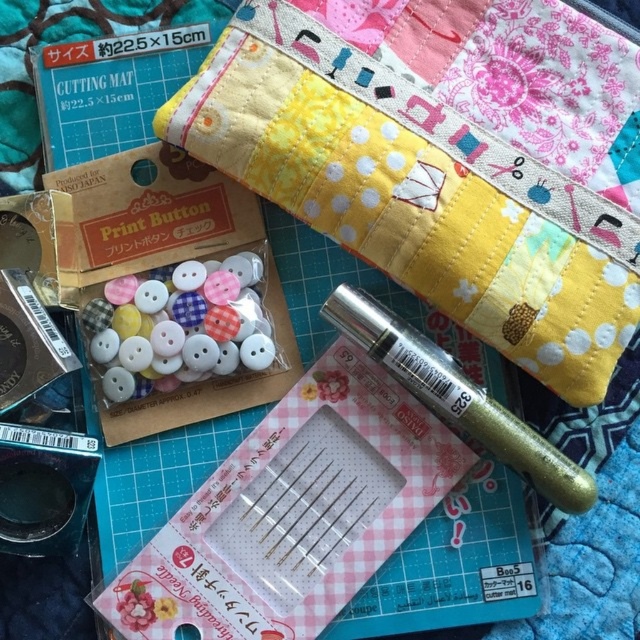
Question: Which object appears closest to the camera in this image?

Choices:
 (A) gold glitter pen at center
 (B) gold glitter pen at upper center

Answer: (A)

Question: Which of the following is the farthest from the observer?

Choices:
 (A) gold glitter pen at center
 (B) gold glitter pen at upper center

Answer: (B)

Question: Does gold glitter pen at upper center lie behind gold glitter pen at center?

Choices:
 (A) no
 (B) yes

Answer: (B)

Question: Is gold glitter pen at upper center to the right of gold glitter pen at center from the viewer's perspective?

Choices:
 (A) no
 (B) yes

Answer: (A)

Question: Is gold glitter pen at upper center below gold glitter pen at center?

Choices:
 (A) no
 (B) yes

Answer: (A)

Question: Which point appears farthest from the camera in this image?

Choices:
 (A) (406, 369)
 (B) (355, 28)

Answer: (B)